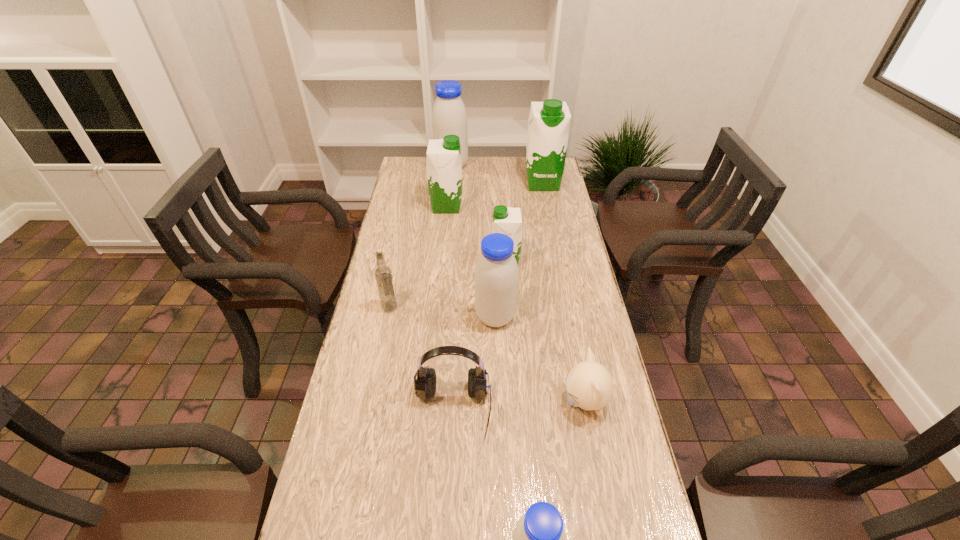
In order to click on the nearest green soya milk in this screenshot , I will do `click(506, 220)`.

Identify the location of headset. This screenshot has height=540, width=960. (425, 385).

This screenshot has height=540, width=960. I want to click on kitten, so click(x=589, y=385).

You are a GUI agent. You are given a task and a screenshot of the screen. Output one action in this format:
    pyautogui.click(x=<x>, y=<y>)
    Task: Click on the free region located 0.090m on the front of the leftmost blue soya milk
    The image size is (960, 540).
    Given the screenshot: What is the action you would take?
    pyautogui.click(x=450, y=185)

Identify the location of free region located on the front-facing side of the rightmost green soya milk. (553, 235).

This screenshot has width=960, height=540. In order to click on blank space located 0.330m on the front-facing side of the third farthest object in this screenshot , I will do `click(543, 207)`.

Locate an element on the screen. blank area located on the front of the second nearest blue soya milk is located at coordinates (496, 354).

At what (x,y) coordinates should I click in order to perform the action: click on blank space located 0.160m on the label of the vodka. Please return your answer as a coordinate pair (x, y). The width and height of the screenshot is (960, 540). Looking at the image, I should click on (448, 307).

This screenshot has width=960, height=540. Identify the location of vacant space situated 0.110m on the front-facing side of the third nearest soya milk. (460, 262).

Where is `free space located on the front-facing side of the third nearest soya milk`? This screenshot has height=540, width=960. free space located on the front-facing side of the third nearest soya milk is located at coordinates (404, 262).